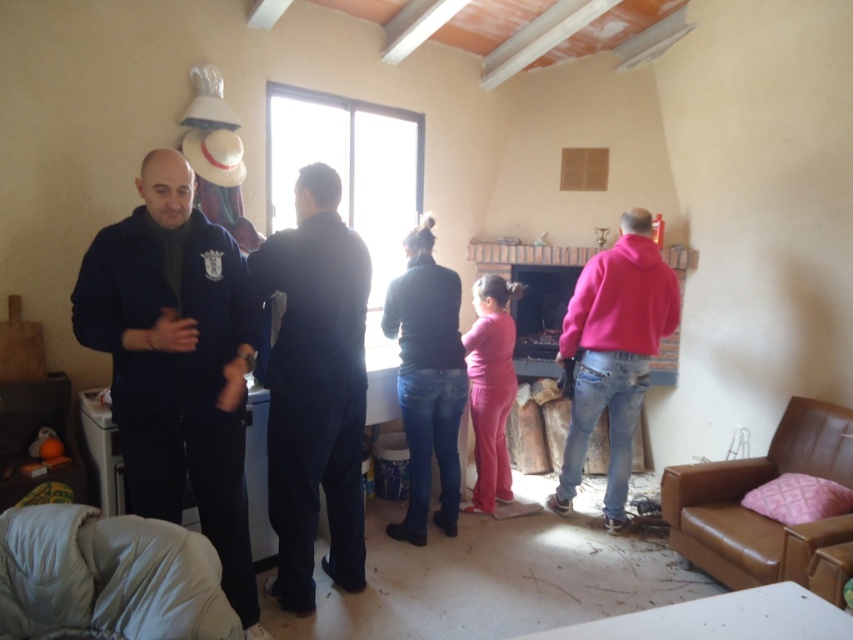
Can you confirm if dark blue fabric at center is bigger than pink matte pants at center?

Yes, dark blue fabric at center is bigger than pink matte pants at center.

Does dark blue fabric at center appear under pink matte pants at center?

No, dark blue fabric at center is not below pink matte pants at center.

Find the location of `dark blue fabric at center`. dark blue fabric at center is located at coordinates (315, 388).

Between dark blue fabric at center and dark blue sweater at center, which one appears on the right side from the viewer's perspective?

From the viewer's perspective, dark blue sweater at center appears more on the right side.

Does dark blue fabric at center appear over dark blue sweater at center?

Correct, dark blue fabric at center is located above dark blue sweater at center.

Does point (276, 422) come farther from viewer compared to point (392, 317)?

No, (276, 422) is in front of (392, 317).

The width and height of the screenshot is (853, 640). Identify the location of dark blue fabric at center. (315, 388).

Between navy blue fleece jacket at left and pink fleece jacket at right, which one appears on the right side from the viewer's perspective?

pink fleece jacket at right

Who is taller, navy blue fleece jacket at left or pink fleece jacket at right?

With more height is navy blue fleece jacket at left.

Which is in front, point (250, 316) or point (590, 291)?

Point (250, 316) is more forward.

At what (x,y) coordinates should I click in order to perform the action: click on navy blue fleece jacket at left. Please return your answer as a coordinate pair (x, y). The height and width of the screenshot is (640, 853). Looking at the image, I should click on (177, 362).